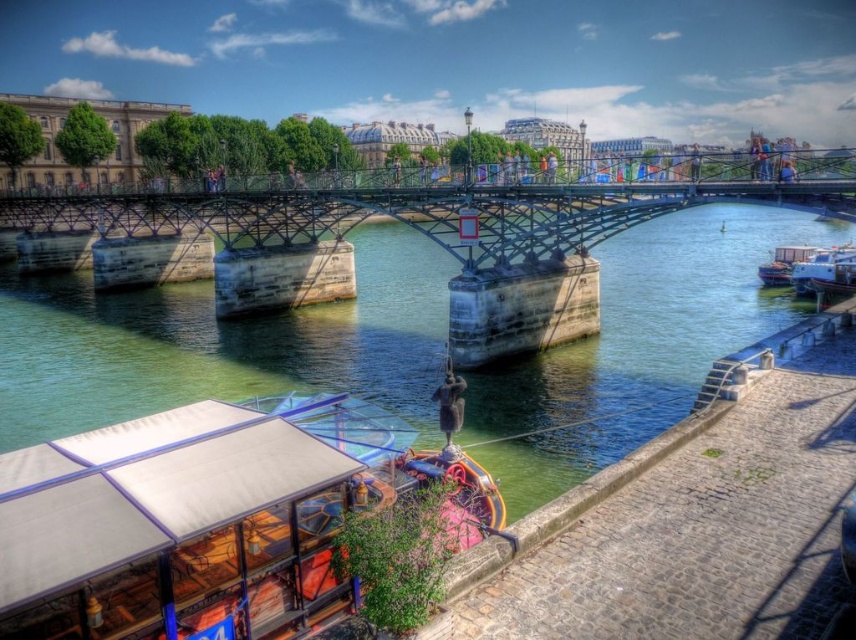
You are a photographer planning to capture the wooden boat at lower left and the white glossy boat at right in a single frame. Considering their heights, which boat will appear larger in the photo?

The wooden boat at lower left will appear larger in the photo because it is taller than the white glossy boat at right.